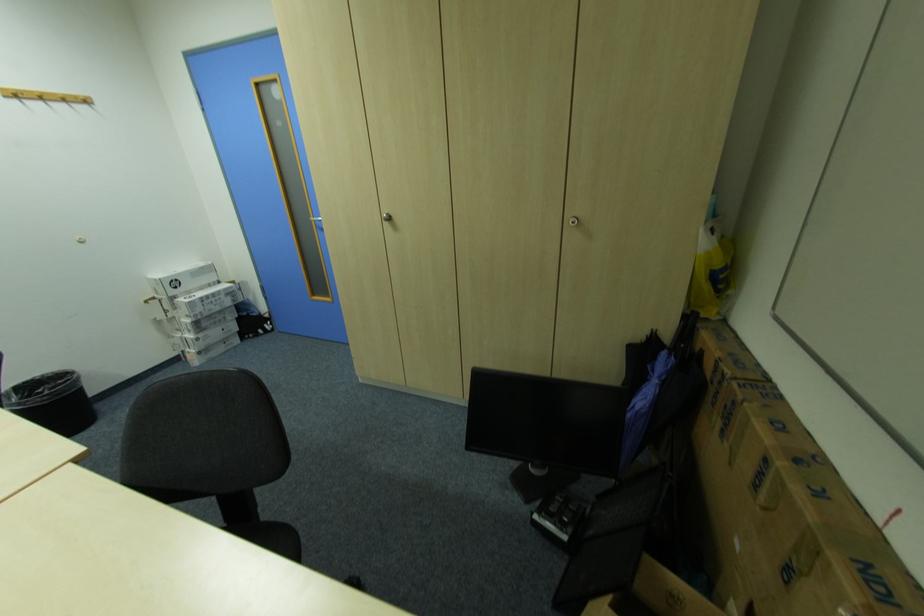
The image size is (924, 616). Describe the element at coordinates (315, 219) in the screenshot. I see `the silver door handle` at that location.